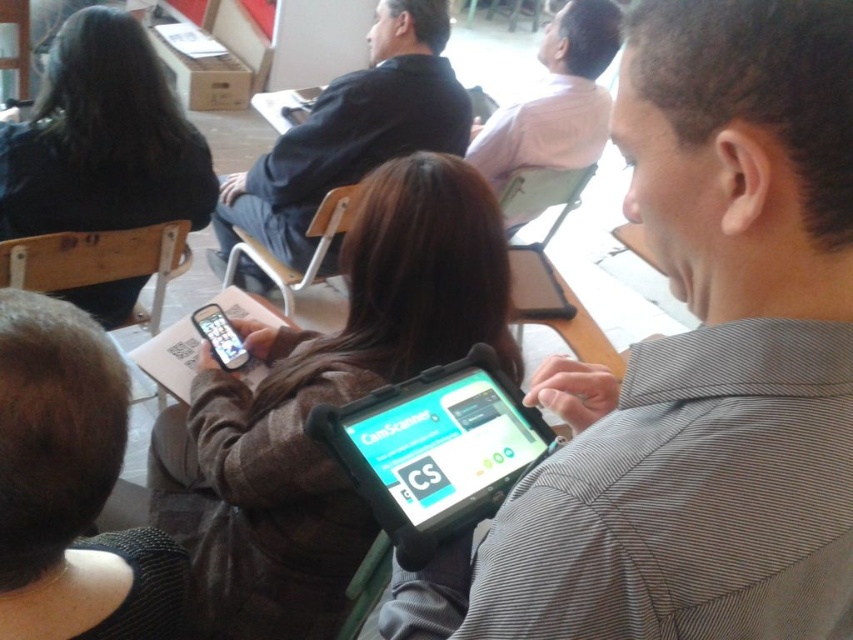
You are standing at the origin point in the image. Which of the two points, point (x=434, y=260) or point (x=329, y=451), is further away from you?

Point (x=434, y=260) is behind point (x=329, y=451), so it is further away from you.

Looking at this image, you are organizing a photo shoot and need to ensure proper lighting for the subjects. Which subject is positioned lower in the frame, the black matte suit at center or the pink fabric shirt at upper center?

The black matte suit at center is positioned under the pink fabric shirt at upper center, so the black matte suit at center is lower in the frame.